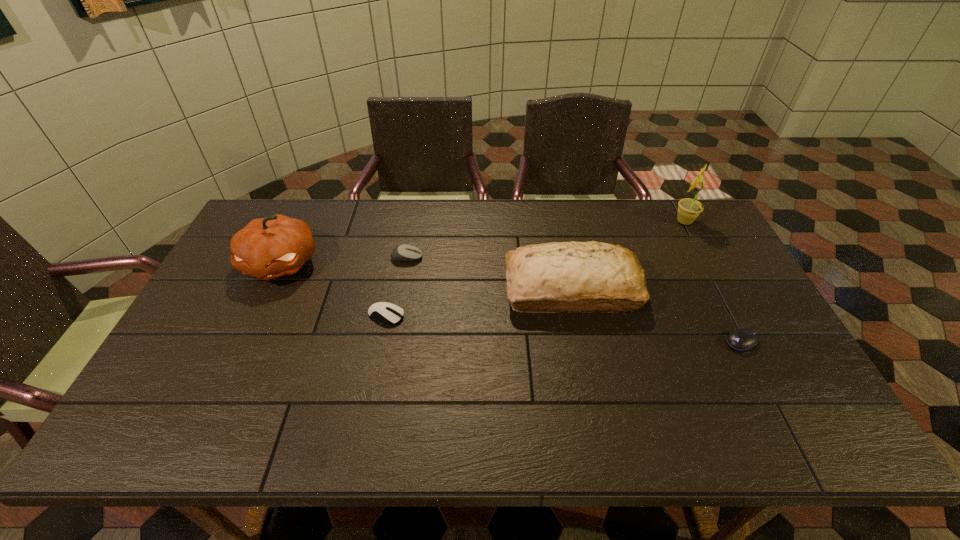
Where is `unoccupied position between the farthest object and the shortest computer mouse`? The height and width of the screenshot is (540, 960). unoccupied position between the farthest object and the shortest computer mouse is located at coordinates (713, 282).

Find the location of a particular element. empty location between the rightmost computer mouse and the second nearest computer mouse is located at coordinates (564, 329).

The height and width of the screenshot is (540, 960). Find the location of `blank region between the second farthest computer mouse and the fourth object from left to right`. blank region between the second farthest computer mouse and the fourth object from left to right is located at coordinates click(479, 302).

Identify the location of free space between the farthest computer mouse and the farthest object. This screenshot has height=540, width=960. (545, 240).

Find the location of a particular element. Image resolution: width=960 pixels, height=540 pixels. empty space between the farthest computer mouse and the fourth shortest object is located at coordinates (489, 274).

At what (x,y) coordinates should I click in order to perform the action: click on vacant space that's between the tallest object and the nearest object. Please return your answer as a coordinate pair (x, y). The height and width of the screenshot is (540, 960). Looking at the image, I should click on (713, 282).

Where is `blank region between the fourth shortest object and the farthest computer mouse`? The width and height of the screenshot is (960, 540). blank region between the fourth shortest object and the farthest computer mouse is located at coordinates (489, 274).

Locate an element on the screen. Image resolution: width=960 pixels, height=540 pixels. object identified as the second closest to the shortest computer mouse is located at coordinates pyautogui.click(x=689, y=209).

This screenshot has width=960, height=540. I want to click on the closest object to the fourth shortest object, so pyautogui.click(x=742, y=339).

This screenshot has height=540, width=960. I want to click on computer mouse object that ranks as the third closest to the fourth shortest object, so click(x=389, y=313).